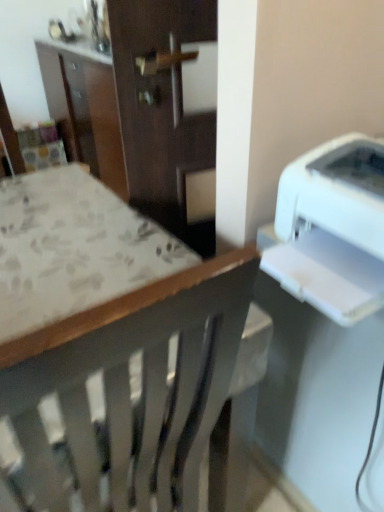
Where is `wooden chair at center`? This screenshot has width=384, height=512. wooden chair at center is located at coordinates (141, 387).

What do you see at coordinates (141, 387) in the screenshot? I see `wooden chair at center` at bounding box center [141, 387].

What do you see at coordinates (332, 228) in the screenshot?
I see `white plastic printer at right` at bounding box center [332, 228].

This screenshot has width=384, height=512. What are the coordinates of `white plastic printer at right` in the screenshot? It's located at (332, 228).

This screenshot has width=384, height=512. Identify the location of wooden chair at center. (141, 387).

Considering the positions of objects white plastic printer at right and wooden chair at center in the image provided, who is more to the right, white plastic printer at right or wooden chair at center?

white plastic printer at right.

Which object is more forward, white plastic printer at right or wooden chair at center?

wooden chair at center is closer to the camera.

Considering the points (315, 269) and (42, 469), which point is in front, point (315, 269) or point (42, 469)?

The point (42, 469) is closer to the camera.

From the image's perspective, which is above, white plastic printer at right or wooden chair at center?

From the image's view, white plastic printer at right is above.

From a real-world perspective, is white plastic printer at right beneath wooden chair at center?

No, from a real-world perspective, white plastic printer at right is not under wooden chair at center.

Considering the sizes of objects white plastic printer at right and wooden chair at center in the image provided, who is thinner, white plastic printer at right or wooden chair at center?

white plastic printer at right.

Considering the relative sizes of white plastic printer at right and wooden chair at center in the image provided, is white plastic printer at right taller than wooden chair at center?

In fact, white plastic printer at right may be shorter than wooden chair at center.

Considering the relative sizes of white plastic printer at right and wooden chair at center in the image provided, is white plastic printer at right bigger than wooden chair at center?

Actually, white plastic printer at right might be smaller than wooden chair at center.

From the picture: Do you think white plastic printer at right is within wooden chair at center, or outside of it?

white plastic printer at right is outside wooden chair at center.

Are white plastic printer at right and wooden chair at center making contact?

They are not placed beside each other.

Is white plastic printer at right facing towards wooden chair at center?

No.

How different are the orientations of white plastic printer at right and wooden chair at center in degrees?

The angular difference between white plastic printer at right and wooden chair at center is 88.5 degrees.

Measure the distance from white plastic printer at right to wooden chair at center.

white plastic printer at right and wooden chair at center are 12.42 inches apart.

Find the location of a particular element. The height and width of the screenshot is (512, 384). printer located on the right of wooden chair at center is located at coordinates (332, 228).

In the image, is wooden chair at center on the left side or the right side of white plastic printer at right?

Based on their positions, wooden chair at center is located to the left of white plastic printer at right.

Considering the relative positions of wooden chair at center and white plastic printer at right in the image provided, is wooden chair at center behind white plastic printer at right?

That is False.

Between point (222, 258) and point (300, 179), which one is positioned in front?

Point (222, 258)

From the image's perspective, does wooden chair at center appear higher than white plastic printer at right?

No, from the image's perspective, wooden chair at center is not over white plastic printer at right.

Consider the image. From a real-world perspective, is wooden chair at center located beneath white plastic printer at right?

Yes, from a real-world perspective, wooden chair at center is below white plastic printer at right.

Which of these two, wooden chair at center or white plastic printer at right, is thinner?

white plastic printer at right is thinner.

Is wooden chair at center shorter than white plastic printer at right?

No.

Can you confirm if wooden chair at center is bigger than white plastic printer at right?

Yes, wooden chair at center is bigger than white plastic printer at right.

Is white plastic printer at right inside wooden chair at center?

Actually, white plastic printer at right is outside wooden chair at center.

Is wooden chair at center not close to white plastic printer at right?

wooden chair at center is actually quite close to white plastic printer at right.

Could you tell me if wooden chair at center is turned towards white plastic printer at right?

No, wooden chair at center is not facing towards white plastic printer at right.

In order to click on chair lying in front of the white plastic printer at right in this screenshot , I will do `click(141, 387)`.

The width and height of the screenshot is (384, 512). I want to click on chair below the white plastic printer at right (from the image's perspective), so click(141, 387).

This screenshot has width=384, height=512. I want to click on printer on the right side of wooden chair at center, so click(x=332, y=228).